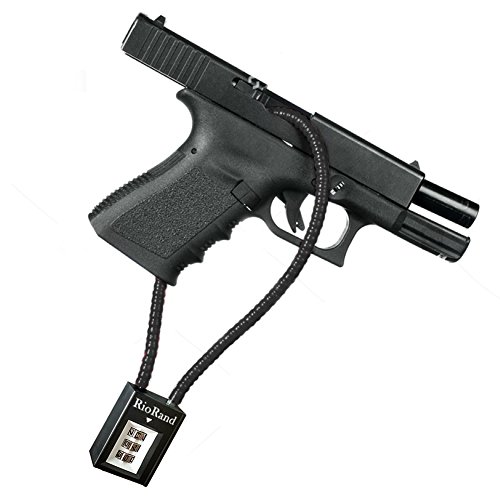
Find the location of a particular element. This screenshot has width=500, height=500. small screw is located at coordinates (194, 150).